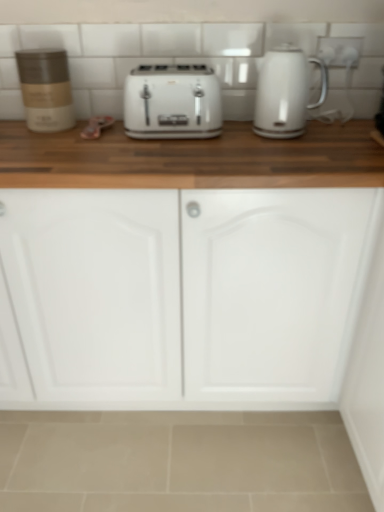
I want to click on empty space that is ontop of white matte cabinet doors at center, so click(x=142, y=144).